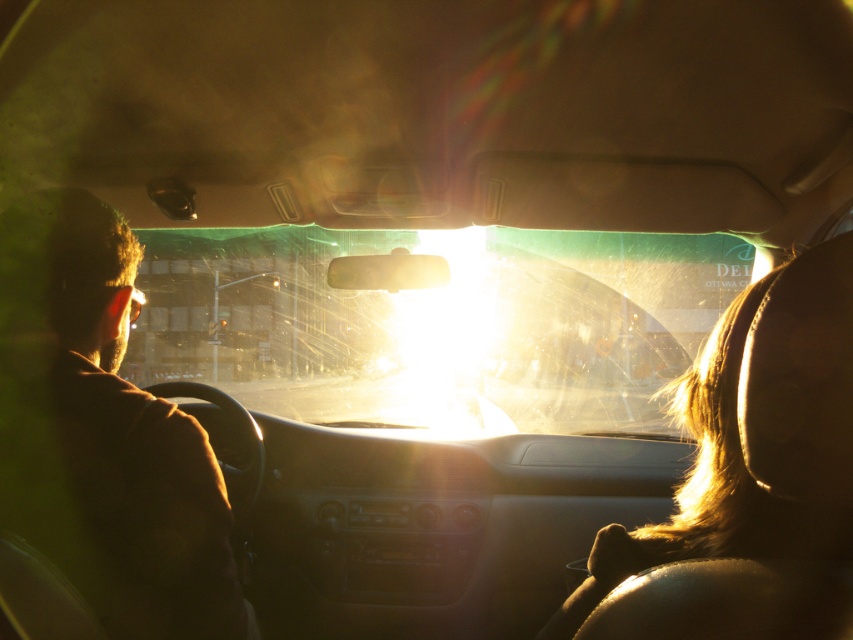
You are sitting in the passenger seat of the car and want to look at the brown fuzzy jacket at left. Which direction should you turn your head to see the transparent glass windshield at center?

To see the transparent glass windshield at center from the passenger seat, you should turn your head to the left since the transparent glass windshield at center is located to the left of the brown fuzzy jacket at left.

You are a passenger in the car and want to see the sunrise outside through the transparent glass windshield at center while wearing the brown fuzzy jacket at left. Can you fully see the sunrise through the windshield without the jacket blocking your view?

The transparent glass windshield at center is bigger than the brown fuzzy jacket at left, so yes, you can fully see the sunrise through the windshield without the jacket blocking your view.